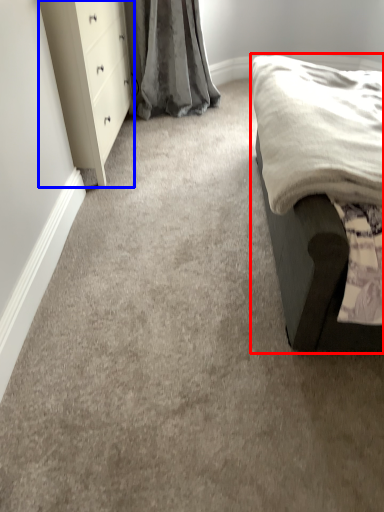
Question: Which of the following is the farthest to the observer, furniture (highlighted by a red box) or chest of drawers (highlighted by a blue box)?

Choices:
 (A) furniture
 (B) chest of drawers

Answer: (B)